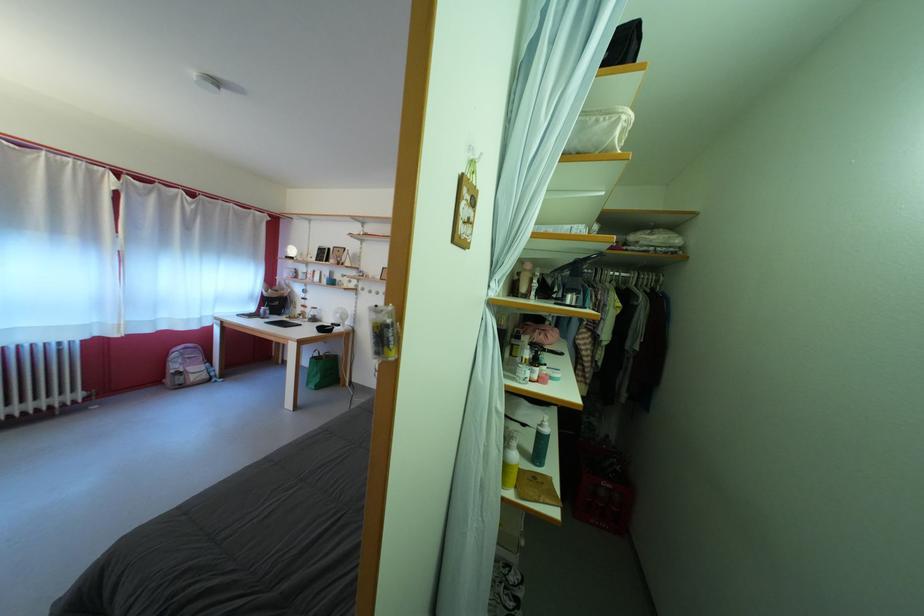
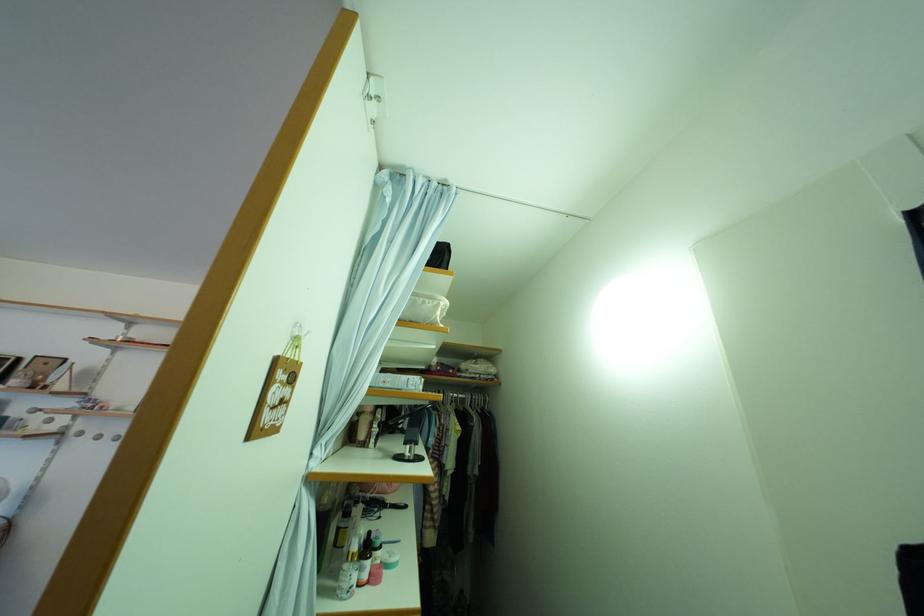
The point at (525, 284) is marked in the first image. Where is the corresponding point in the second image?

(363, 424)